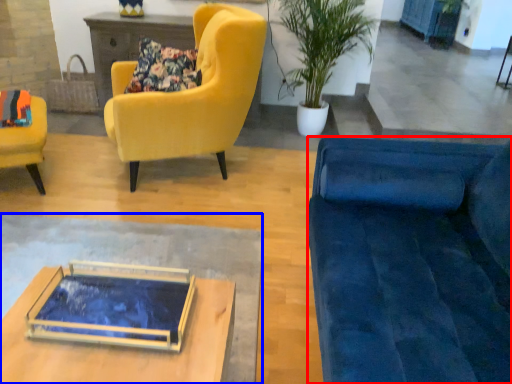
Question: Which object appears farthest to the camera in this image, studio couch (highlighted by a red box) or desk (highlighted by a blue box)?

Choices:
 (A) studio couch
 (B) desk

Answer: (B)